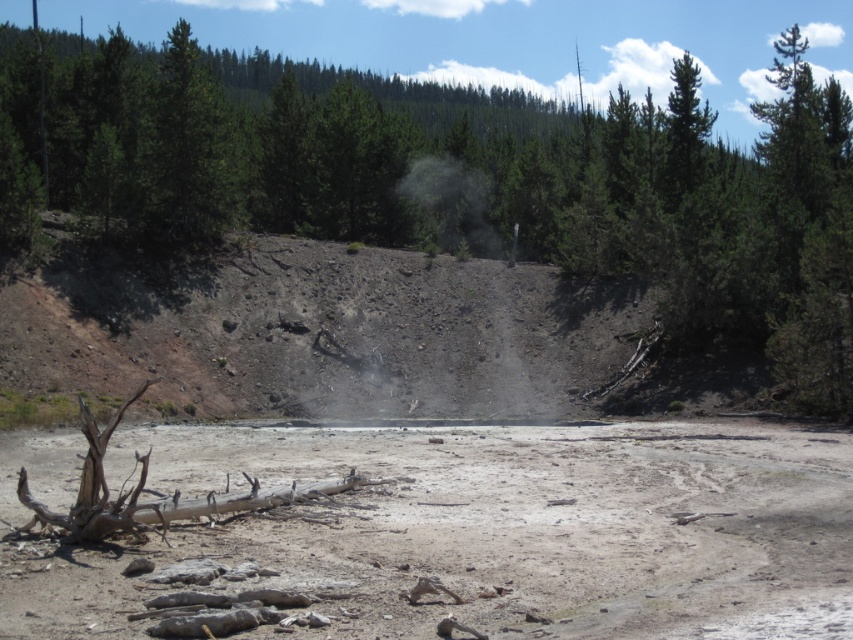
From the picture: You are a hiker who has just arrived at this geothermal area. You see the dull brown dirt at center and the brown rough log at center. Which object is positioned to the right side of the other?

The dull brown dirt at center is to the right of the brown rough log at center.

You are standing on the edge of the geothermal area and see the point marked at coordinates (450, 532). What is the color of the material at that point?

The point at (450, 532) corresponds to dull brown dirt at center.